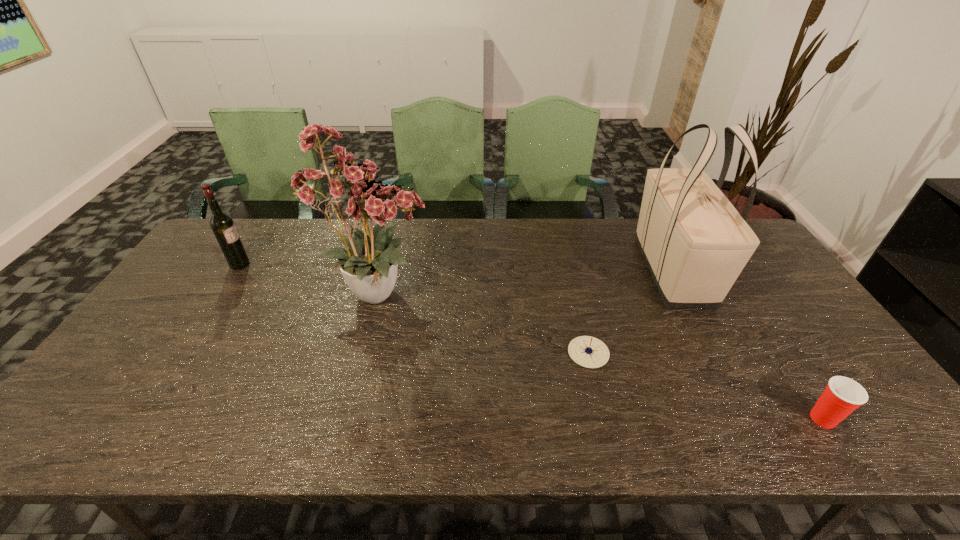
I want to click on free spot located 0.160m on the front and back of the wine bottle, so click(x=300, y=265).

The width and height of the screenshot is (960, 540). What are the coordinates of `free space located on the back of the nearest object` in the screenshot? It's located at (796, 376).

The width and height of the screenshot is (960, 540). I want to click on vacant space situated on the right of the shortest object, so click(x=698, y=353).

At what (x,y) coordinates should I click in order to perform the action: click on shopping bag present at the far edge. Please return your answer as a coordinate pair (x, y). Looking at the image, I should click on (695, 243).

This screenshot has width=960, height=540. Find the location of `wine bottle located at the far edge`. wine bottle located at the far edge is located at coordinates (222, 225).

Where is `object situated at the near edge`? The width and height of the screenshot is (960, 540). object situated at the near edge is located at coordinates (842, 395).

In order to click on object that is at the left edge in this screenshot , I will do `click(222, 225)`.

The height and width of the screenshot is (540, 960). Identify the location of object positioned at the right edge. (842, 395).

At what (x,y) coordinates should I click in order to perform the action: click on object located in the far left corner section of the desktop. Please return your answer as a coordinate pair (x, y). Looking at the image, I should click on (222, 225).

This screenshot has width=960, height=540. Identify the location of object that is at the near right corner. (842, 395).